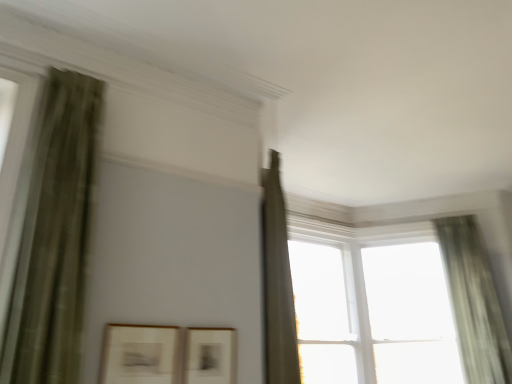
Question: Looking at their shapes, would you say transparent glass window at upper right, the 2th window in the right-to-left sequence, is wider or thinner than matte white picture frame at lower left, marked as the 1th picture frame in a left-to-right arrangement?

Choices:
 (A) wide
 (B) thin

Answer: (A)

Question: Is transparent glass window at upper right, the 2th window in the right-to-left sequence, inside the boundaries of matte white picture frame at lower left, the 2th picture frame from the right, or outside?

Choices:
 (A) outside
 (B) inside

Answer: (A)

Question: Estimate the real-world distances between objects in this image. Which object is farther from the transparent glass window at upper right, marked as the 1th window in a right-to-left arrangement?

Choices:
 (A) green sheer curtain at right, which appears as the first curtain when viewed from the back
 (B) matte white picture frame at lower left, the 2th picture frame from the right
 (C) white glass window at center, which is counted as the first window, starting from the left
 (D) matte black picture frame at center, the 2th picture frame when ordered from left to right
 (E) transparent glass window at upper right, which is the second window from left to right

Answer: (B)

Question: Estimate the real-world distances between objects in this image. Which object is farther from the matte white picture frame at lower left, the 2th picture frame from the right?

Choices:
 (A) transparent glass window at upper right, marked as the 1th window in a right-to-left arrangement
 (B) transparent glass window at upper right, which is the second window from left to right
 (C) green textured curtain at left, the 1th curtain positioned from the front
 (D) white glass window at center, the third window when ordered from right to left
 (E) matte black picture frame at center, the 2th picture frame when ordered from left to right

Answer: (A)